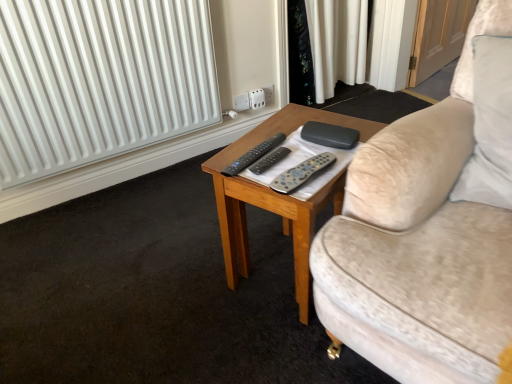
Question: From a real-world perspective, is gray matte remote control at center, placed as the 3th remote control when sorted from left to right, under white plastic socket at upper center?

Choices:
 (A) no
 (B) yes

Answer: (A)

Question: Can you confirm if gray matte remote control at center, the 1th remote control viewed from the right, is positioned to the right of white plastic socket at upper center?

Choices:
 (A) yes
 (B) no

Answer: (A)

Question: Is gray matte remote control at center, the 1th remote control viewed from the right, taller than white plastic socket at upper center?

Choices:
 (A) yes
 (B) no

Answer: (B)

Question: Is gray matte remote control at center, the 1th remote control viewed from the right, in front of white plastic socket at upper center?

Choices:
 (A) no
 (B) yes

Answer: (B)

Question: Is gray matte remote control at center, the 1th remote control viewed from the right, positioned with its back to white plastic socket at upper center?

Choices:
 (A) no
 (B) yes

Answer: (A)

Question: Is point pos(342,127) positioned closer to the camera than point pos(256,89)?

Choices:
 (A) closer
 (B) farther

Answer: (A)

Question: In terms of height, does black matte case at center look taller or shorter compared to white plastic socket at upper center?

Choices:
 (A) short
 (B) tall

Answer: (A)

Question: Is black matte case at center wider or thinner than white plastic socket at upper center?

Choices:
 (A) thin
 (B) wide

Answer: (B)

Question: Visually, is black matte case at center positioned to the left or to the right of white plastic socket at upper center?

Choices:
 (A) right
 (B) left

Answer: (A)

Question: Is wooden coffee table at center taller or shorter than black matte remote control at center, which appears as the first remote control when viewed from the left?

Choices:
 (A) tall
 (B) short

Answer: (A)

Question: Considering their positions, is wooden coffee table at center located in front of or behind black matte remote control at center, the third remote control positioned from the right?

Choices:
 (A) front
 (B) behind

Answer: (A)

Question: From a real-world perspective, is wooden coffee table at center physically located above or below black matte remote control at center, the third remote control positioned from the right?

Choices:
 (A) below
 (B) above

Answer: (A)

Question: From the image's perspective, is wooden coffee table at center above or below black matte remote control at center, the third remote control positioned from the right?

Choices:
 (A) above
 (B) below

Answer: (B)

Question: Considering their positions, is gray matte remote control at center, placed as the 3th remote control when sorted from left to right, located in front of or behind black matte remote control at center, which appears as the first remote control when viewed from the left?

Choices:
 (A) behind
 (B) front

Answer: (B)

Question: Considering the positions of point (305, 168) and point (260, 153), is point (305, 168) closer or farther from the camera than point (260, 153)?

Choices:
 (A) closer
 (B) farther

Answer: (A)